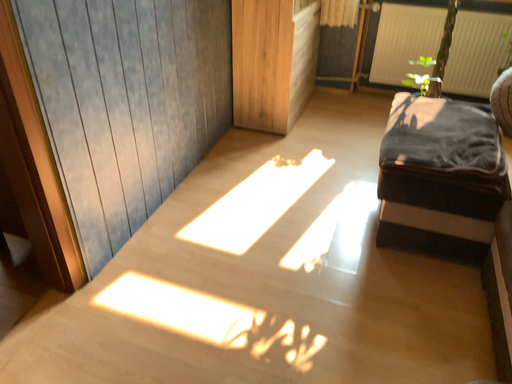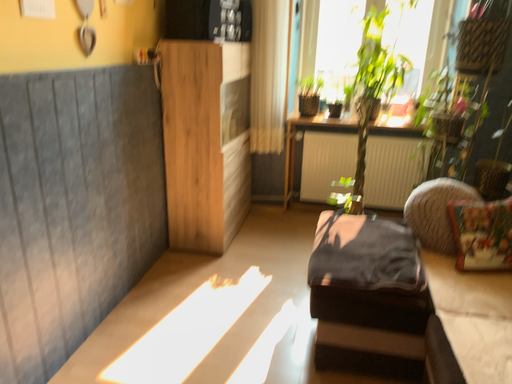
Question: Which way did the camera rotate in the video?

Choices:
 (A) rotated downward
 (B) rotated upward

Answer: (B)